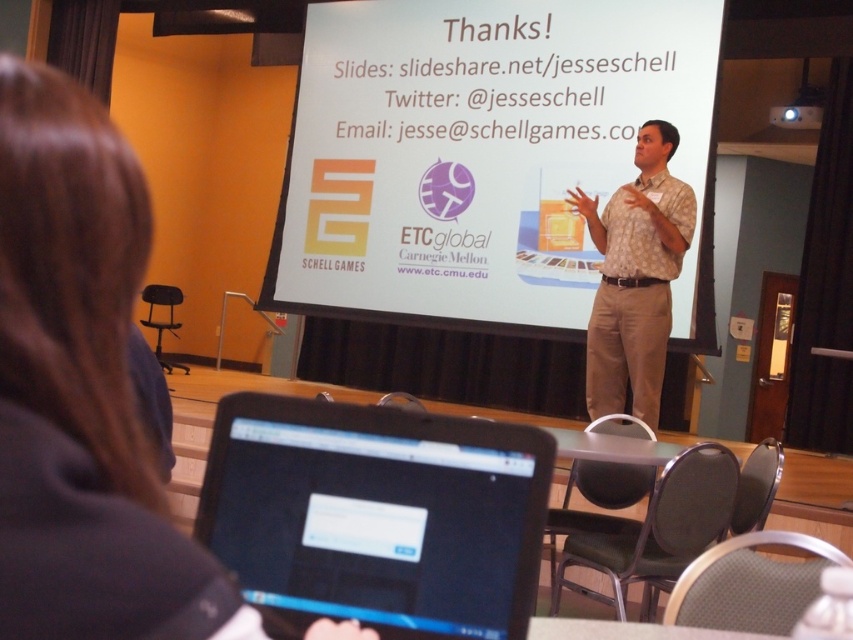
You are organizing a presentation and need to place a white paper at center and a white plastic projector at upper right. According to the scene, where should you position the white paper relative to the white plastic projector?

The white paper at center should be positioned below the white plastic projector at upper right.

What object is located at the coordinates point [376,516]?

The point [376,516] is on the black glossy laptop at lower center.

You are organizing a meeting and need to determine which item is larger between the white paper at center and the brown hair at upper left. Based on the scene description, which object is larger?

The white paper at center is larger than the brown hair at upper left according to the description.